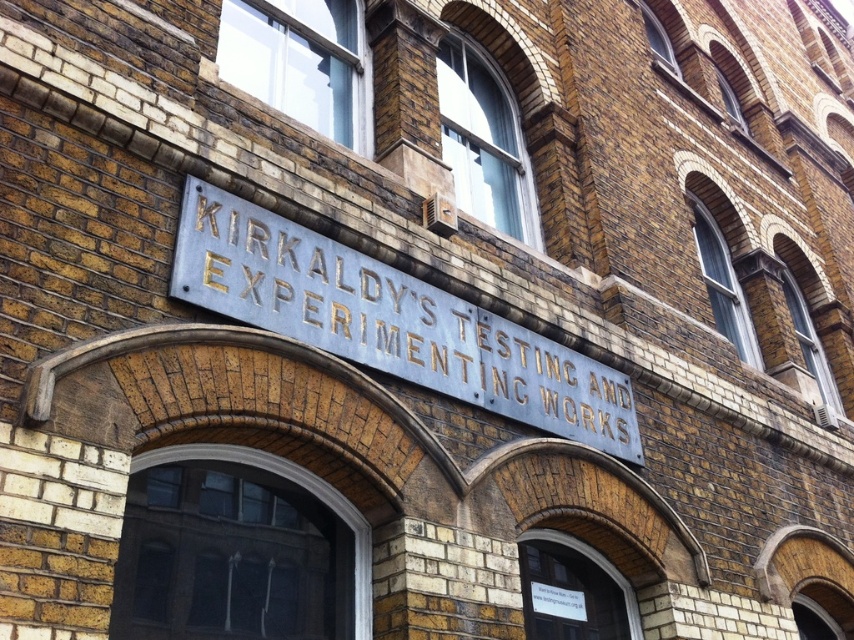
Question: Which point is farther from the camera taking this photo?

Choices:
 (A) (349, 296)
 (B) (130, 472)
 (C) (562, 534)

Answer: (C)

Question: Is transparent glass door at lower left to the right of white paper sign at lower center from the viewer's perspective?

Choices:
 (A) yes
 (B) no

Answer: (B)

Question: Among these objects, which one is nearest to the camera?

Choices:
 (A) white plastic sign at center
 (B) white paper sign at lower center
 (C) silver metallic sign at center
 (D) transparent glass door at lower left

Answer: (D)

Question: Does silver metallic sign at center lie in front of white paper sign at lower center?

Choices:
 (A) yes
 (B) no

Answer: (A)

Question: Is transparent glass door at lower left further to camera compared to white plastic sign at center?

Choices:
 (A) yes
 (B) no

Answer: (B)

Question: Which object is farther from the camera taking this photo?

Choices:
 (A) white plastic sign at center
 (B) transparent glass door at lower left
 (C) white paper sign at lower center
 (D) silver metallic sign at center

Answer: (C)